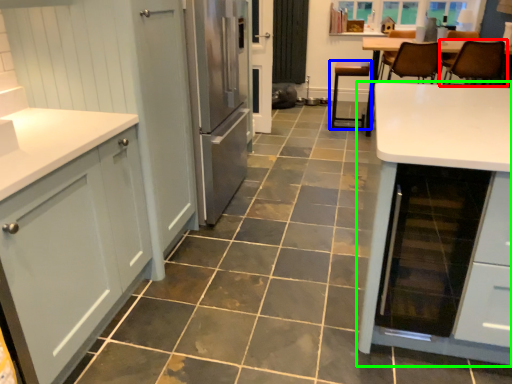
Question: Which is farther away from chair (highlighted by a red box)? chair (highlighted by a blue box) or table (highlighted by a green box)?

Choices:
 (A) chair
 (B) table

Answer: (B)